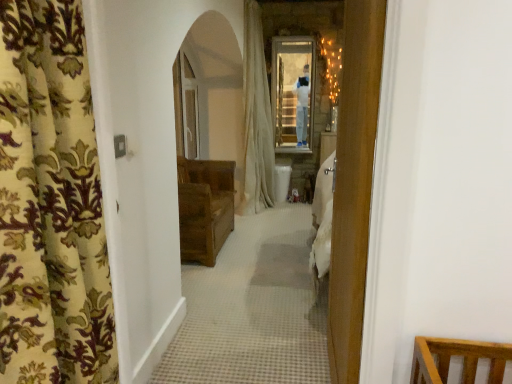
The height and width of the screenshot is (384, 512). What do you see at coordinates (204, 208) in the screenshot? I see `brown wooden chest at center` at bounding box center [204, 208].

Locate an element on the screen. This screenshot has width=512, height=384. floral fabric curtain at left, placed as the 1th curtain when sorted from front to back is located at coordinates (51, 204).

I want to click on white fabric curtain at center, arranged as the first curtain when viewed from the right, so click(257, 116).

Measure the distance from brown wooden chest at center to floral fabric curtain at left, which is the second curtain in back-to-front order.

They are 2.21 meters apart.

Which object is wider, brown wooden chest at center or floral fabric curtain at left, which is the second curtain in back-to-front order?

With larger width is brown wooden chest at center.

Is brown wooden chest at center at the left side of floral fabric curtain at left, which is the second curtain in back-to-front order?

Yes, brown wooden chest at center is to the left of floral fabric curtain at left, which is the second curtain in back-to-front order.

Which is in front, brown wooden chest at center or floral fabric curtain at left, which is the second curtain in back-to-front order?

floral fabric curtain at left, which is the second curtain in back-to-front order.

Is white fabric curtain at center, the 2th curtain from the left, positioned far away from floral fabric curtain at left, marked as the first curtain in a left-to-right arrangement?

white fabric curtain at center, the 2th curtain from the left, is far away from floral fabric curtain at left, marked as the first curtain in a left-to-right arrangement.

Based on the photo, is white fabric curtain at center, acting as the 2th curtain starting from the front, oriented towards floral fabric curtain at left, placed as the 1th curtain when sorted from front to back?

No, white fabric curtain at center, acting as the 2th curtain starting from the front, is not oriented towards floral fabric curtain at left, placed as the 1th curtain when sorted from front to back.

What's the angular difference between white fabric curtain at center, acting as the 2th curtain starting from the front, and floral fabric curtain at left, which is the second curtain in back-to-front order,'s facing directions?

2.16 degrees.

Based on the photo, which object is positioned more to the right, white fabric curtain at center, acting as the 2th curtain starting from the front, or floral fabric curtain at left, the second curtain in the right-to-left sequence?

white fabric curtain at center, acting as the 2th curtain starting from the front.

Can you confirm if floral fabric curtain at left, which is the second curtain in back-to-front order, is bigger than white fabric curtain at center, the first curtain from the back?

Actually, floral fabric curtain at left, which is the second curtain in back-to-front order, might be smaller than white fabric curtain at center, the first curtain from the back.

From the image's perspective, would you say floral fabric curtain at left, which is the second curtain in back-to-front order, is positioned over white fabric curtain at center, arranged as the first curtain when viewed from the right?

No, from the image's perspective, floral fabric curtain at left, which is the second curtain in back-to-front order, is not above white fabric curtain at center, arranged as the first curtain when viewed from the right.

Which of these two, brown wooden chest at center or white fabric curtain at center, the 2th curtain from the left, stands taller?

With more height is white fabric curtain at center, the 2th curtain from the left.

Does point (210, 222) lie in front of point (247, 126)?

That is True.

Considering the relative sizes of brown wooden chest at center and white fabric curtain at center, the 2th curtain from the left, in the image provided, is brown wooden chest at center thinner than white fabric curtain at center, the 2th curtain from the left,?

Incorrect, the width of brown wooden chest at center is not less than that of white fabric curtain at center, the 2th curtain from the left.

Could you tell me if brown wooden chest at center is turned towards white fabric curtain at center, the first curtain from the back?

No, brown wooden chest at center does not turn towards white fabric curtain at center, the first curtain from the back.

How much distance is there between white fabric curtain at center, acting as the 2th curtain starting from the front, and brown wooden chest at center?

white fabric curtain at center, acting as the 2th curtain starting from the front, and brown wooden chest at center are 1.02 meters apart from each other.

Is the position of white fabric curtain at center, arranged as the first curtain when viewed from the right, more distant than that of brown wooden chest at center?

Yes, it is behind brown wooden chest at center.

From the image's perspective, between white fabric curtain at center, arranged as the first curtain when viewed from the right, and brown wooden chest at center, who is located below?

From the image's view, brown wooden chest at center is below.

From a real-world perspective, which object stands above the other?

floral fabric curtain at left, placed as the 1th curtain when sorted from front to back, is physically above.

The image size is (512, 384). Identify the location of furniture lying on the left of floral fabric curtain at left, which is the second curtain in back-to-front order. (x=204, y=208).

Can you see floral fabric curtain at left, marked as the first curtain in a left-to-right arrangement, touching brown wooden chest at center?

There is a gap between floral fabric curtain at left, marked as the first curtain in a left-to-right arrangement, and brown wooden chest at center.

Consider the image. Which is closer to the camera, (53, 221) or (184, 209)?

Clearly, point (53, 221) is closer to the camera than point (184, 209).

At what (x,y) coordinates should I click in order to perform the action: click on furniture that is on the left side of floral fabric curtain at left, which is the second curtain in back-to-front order. Please return your answer as a coordinate pair (x, y). The height and width of the screenshot is (384, 512). Looking at the image, I should click on (204, 208).

At what (x,y) coordinates should I click in order to perform the action: click on curtain lying below the white fabric curtain at center, the 2th curtain from the left (from the image's perspective). Please return your answer as a coordinate pair (x, y). This screenshot has width=512, height=384. Looking at the image, I should click on (51, 204).

Which object lies nearer to the anchor point floral fabric curtain at left, marked as the first curtain in a left-to-right arrangement, brown wooden chest at center or white fabric curtain at center, arranged as the first curtain when viewed from the right?

brown wooden chest at center is closer to floral fabric curtain at left, marked as the first curtain in a left-to-right arrangement.

Looking at the image, which one is located closer to floral fabric curtain at left, placed as the 1th curtain when sorted from front to back, white fabric curtain at center, acting as the 2th curtain starting from the front, or brown wooden chest at center?

brown wooden chest at center is positioned closer to the anchor floral fabric curtain at left, placed as the 1th curtain when sorted from front to back.

Which object lies nearer to the anchor point white fabric curtain at center, the first curtain from the back, floral fabric curtain at left, the second curtain in the right-to-left sequence, or brown wooden chest at center?

Among the two, brown wooden chest at center is located nearer to white fabric curtain at center, the first curtain from the back.

Considering their positions, is floral fabric curtain at left, marked as the first curtain in a left-to-right arrangement, positioned closer to brown wooden chest at center than white fabric curtain at center, the first curtain from the back?

white fabric curtain at center, the first curtain from the back, is positioned closer to the anchor brown wooden chest at center.

Looking at the image, which one is located further to brown wooden chest at center, white fabric curtain at center, the 2th curtain from the left, or floral fabric curtain at left, which is the second curtain in back-to-front order?

floral fabric curtain at left, which is the second curtain in back-to-front order, is further to brown wooden chest at center.

Considering their positions, is brown wooden chest at center positioned closer to white fabric curtain at center, the 2th curtain from the left, than floral fabric curtain at left, marked as the first curtain in a left-to-right arrangement?

Based on the image, brown wooden chest at center appears to be nearer to white fabric curtain at center, the 2th curtain from the left.

The width and height of the screenshot is (512, 384). I want to click on furniture between floral fabric curtain at left, marked as the first curtain in a left-to-right arrangement, and white fabric curtain at center, acting as the 2th curtain starting from the front, from front to back, so click(204, 208).